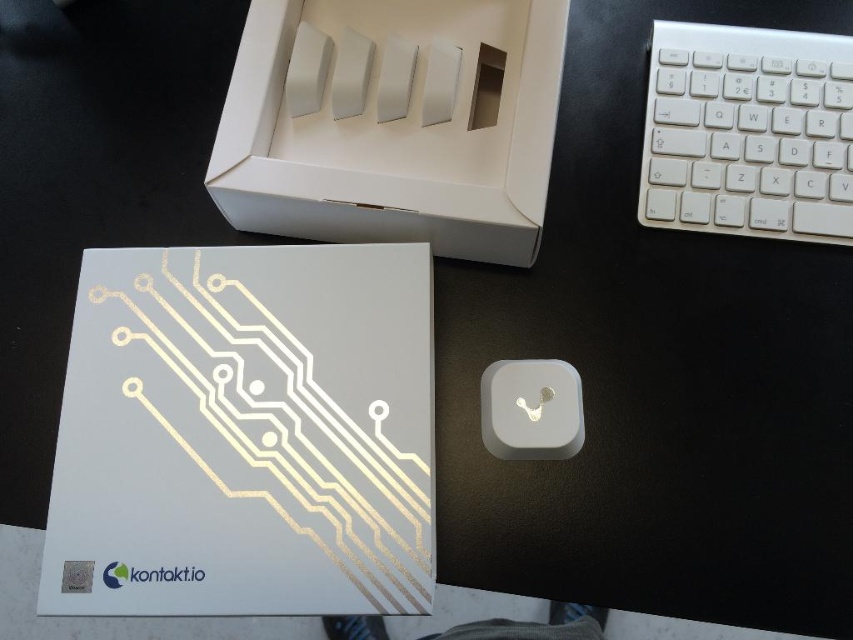
Is point (770, 188) behind point (498, 419)?

Yes, it is.

Locate an element on the screen. The height and width of the screenshot is (640, 853). white plastic keyboard at upper right is located at coordinates (747, 132).

Does white matte box at upper center come in front of white plastic keyboard at upper right?

Yes, white matte box at upper center is closer to the viewer.

Is white matte box at upper center positioned behind white plastic keyboard at upper right?

No.

You are a GUI agent. You are given a task and a screenshot of the screen. Output one action in this format:
    pyautogui.click(x=<x>, y=<y>)
    Task: Click on the white matte box at upper center
    
    Given the screenshot: What is the action you would take?
    pyautogui.click(x=393, y=124)

Identify the location of white matte box at upper center. (393, 124).

Is point (556, 77) closer to camera compared to point (531, 372)?

Yes, point (556, 77) is closer to viewer.

Image resolution: width=853 pixels, height=640 pixels. In order to click on white matte box at upper center in this screenshot , I will do `click(393, 124)`.

Who is more distant from viewer, (239, 104) or (486, 392)?

Positioned behind is point (486, 392).

Locate an element on the screen. Image resolution: width=853 pixels, height=640 pixels. white matte box at upper center is located at coordinates (393, 124).